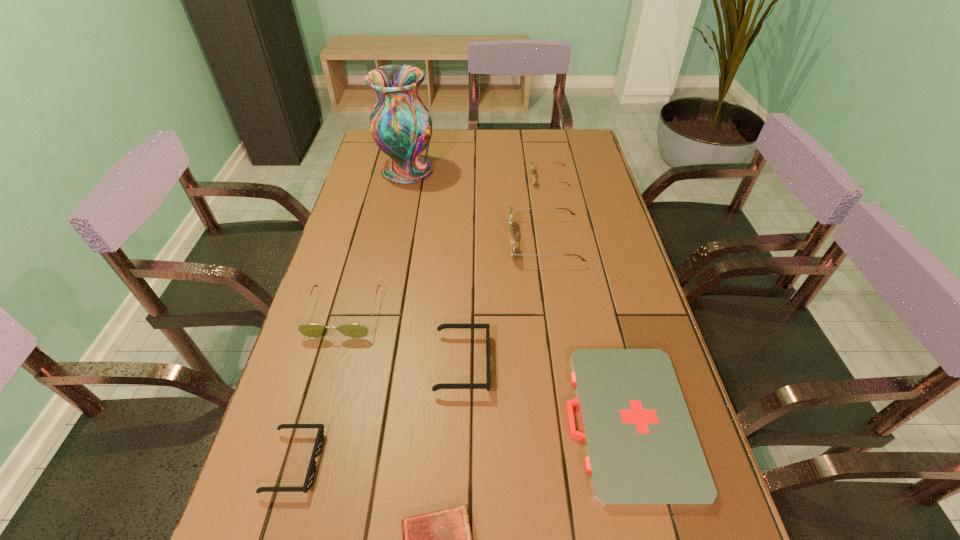
This screenshot has width=960, height=540. What are the coordinates of `the shortest sunglasses` in the screenshot? It's located at (311, 472).

Locate an element on the screen. the first-aid kit is located at coordinates (642, 450).

Where is `free spot located on the back of the tallest object`? The height and width of the screenshot is (540, 960). free spot located on the back of the tallest object is located at coordinates (415, 135).

Where is `vacant space located 0.090m on the front-facing side of the sixth nearest object`? The width and height of the screenshot is (960, 540). vacant space located 0.090m on the front-facing side of the sixth nearest object is located at coordinates (480, 242).

Locate an element on the screen. free point located on the front-facing side of the sixth nearest object is located at coordinates (480, 242).

Identify the location of vacant space located 0.100m on the front-facing side of the sixth nearest object. The height and width of the screenshot is (540, 960). (477, 242).

The height and width of the screenshot is (540, 960). Identify the location of free point located 0.290m on the front-facing side of the second tallest sunglasses. (303, 461).

This screenshot has width=960, height=540. In order to click on free spot located on the front-facing side of the farthest green sunglasses in this screenshot , I will do `click(509, 179)`.

I want to click on vacant space located on the front-facing side of the farthest green sunglasses, so click(x=500, y=179).

The image size is (960, 540). I want to click on free spot located on the front-facing side of the farthest green sunglasses, so click(x=471, y=179).